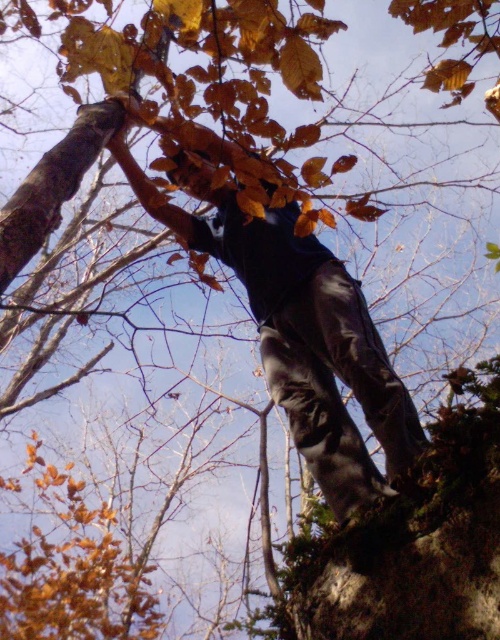
You are a photographer trying to capture a clear shot of the black matte pants at center. However, the dark gray rock at lower right is blocking your view. Can you move the rock to the side to get a better angle?

The dark gray rock at lower right is behind the black matte pants at center, so moving the rock won not improve the view since it is already positioned behind the pants.

You are a drone operator trying to capture a photo of the black matte pants at center and the dark gray rock at lower right. The minimum distance between the two objects must be at least 60 centimeters to ensure both are in focus. Based on the scene, can you confirm if this requirement is met?

The black matte pants at center and dark gray rock at lower right are 63.43 centimeters apart, which meets the minimum distance requirement of 60 centimeters. Therefore, both objects can be in focus in the photo.

You are a photographer trying to capture the climber in the tree. You notice the black matte pants at center and the dark gray rock at lower right. Which object should you focus on to ensure it appears larger in your photo?

The black matte pants at center should be focused on because it is bigger than the dark gray rock at lower right, making it the larger subject in the scene.